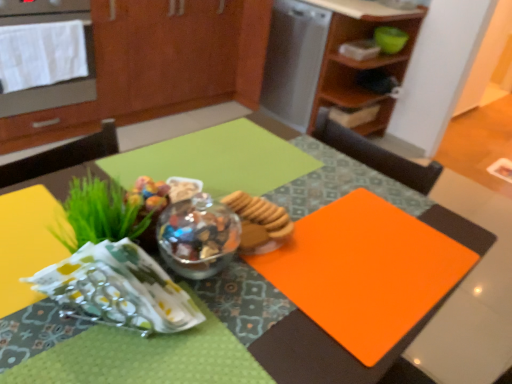
Describe the element at coordinates (361, 61) in the screenshot. The width and height of the screenshot is (512, 384). I see `wooden cabinet at upper right, placed as the 2th cabinetry when sorted from left to right` at that location.

Where is `wooden cabinet at upper right, the first cabinetry in the right-to-left sequence`? The image size is (512, 384). wooden cabinet at upper right, the first cabinetry in the right-to-left sequence is located at coordinates (361, 61).

Image resolution: width=512 pixels, height=384 pixels. In order to click on matte wood cabinetry at upper center, the first cabinetry viewed from the left in this screenshot , I will do `click(158, 67)`.

Describe the element at coordinates (365, 271) in the screenshot. I see `orange matte placemat at center` at that location.

Image resolution: width=512 pixels, height=384 pixels. What do you see at coordinates (294, 60) in the screenshot?
I see `satin silver dishwasher at upper center` at bounding box center [294, 60].

In order to face green leafy grass at left, should I rotate leftwards or rightwards?

Turn left approximately 18.620 degrees to face it.

At what (x,y) coordinates should I click in order to perform the action: click on green leafy grass at left. Please return your answer as a coordinate pair (x, y). Looking at the image, I should click on (99, 213).

In order to click on wooden cabinet at upper right, the first cabinetry in the right-to-left sequence in this screenshot , I will do `click(361, 61)`.

Is satin silver dishwasher at upper center closer to the viewer compared to orange matte placemat at center?

No.

Are satin silver dishwasher at upper center and orange matte placemat at center beside each other?

There is a gap between satin silver dishwasher at upper center and orange matte placemat at center.

Who is smaller, satin silver dishwasher at upper center or orange matte placemat at center?

satin silver dishwasher at upper center is smaller.

Considering the points (198, 100) and (342, 361), which point is in front, point (198, 100) or point (342, 361)?

Point (342, 361)

How different are the orientations of matte wood cabinetry at upper center, the first cabinetry viewed from the left, and orange matte placemat at center in degrees?

The angular difference between matte wood cabinetry at upper center, the first cabinetry viewed from the left, and orange matte placemat at center is 179 degrees.

Does matte wood cabinetry at upper center, the first cabinetry viewed from the left, have a greater width compared to orange matte placemat at center?

Incorrect, the width of matte wood cabinetry at upper center, the first cabinetry viewed from the left, does not surpass that of orange matte placemat at center.

Does point (113, 76) come behind point (379, 34)?

No, it is not.

Considering the sizes of matte wood cabinetry at upper center, the first cabinetry viewed from the left, and teal bowl at upper right in the image, is matte wood cabinetry at upper center, the first cabinetry viewed from the left, taller or shorter than teal bowl at upper right?

In the image, matte wood cabinetry at upper center, the first cabinetry viewed from the left, appears to be taller than teal bowl at upper right.

From the picture: Can you tell me how much matte wood cabinetry at upper center, which is the 2th cabinetry in right-to-left order, and teal bowl at upper right differ in facing direction?

The angular difference between matte wood cabinetry at upper center, which is the 2th cabinetry in right-to-left order, and teal bowl at upper right is 0.526 degrees.

From a real-world perspective, who is located higher, matte wood cabinetry at upper center, which is the 2th cabinetry in right-to-left order, or teal bowl at upper right?

From a 3D spatial view, teal bowl at upper right is above.

Is satin silver dishwasher at upper center far from orange matte placemat at center?

satin silver dishwasher at upper center is positioned a significant distance from orange matte placemat at center.

From the image's perspective, is satin silver dishwasher at upper center located above or below orange matte placemat at center?

Clearly, from the image's perspective, satin silver dishwasher at upper center is above orange matte placemat at center.

How different are the orientations of satin silver dishwasher at upper center and orange matte placemat at center in degrees?

satin silver dishwasher at upper center and orange matte placemat at center are facing 91.2 degrees away from each other.

Between satin silver dishwasher at upper center and orange matte placemat at center, which one appears on the left side from the viewer's perspective?

Positioned to the left is orange matte placemat at center.

Between teal bowl at upper right and wooden cabinet at upper right, the first cabinetry in the right-to-left sequence, which one has more height?

wooden cabinet at upper right, the first cabinetry in the right-to-left sequence.

Considering the sizes of teal bowl at upper right and wooden cabinet at upper right, the first cabinetry in the right-to-left sequence, in the image, is teal bowl at upper right bigger or smaller than wooden cabinet at upper right, the first cabinetry in the right-to-left sequence,?

teal bowl at upper right is smaller than wooden cabinet at upper right, the first cabinetry in the right-to-left sequence.

Considering the positions of objects teal bowl at upper right and wooden cabinet at upper right, placed as the 2th cabinetry when sorted from left to right, in the image provided, who is behind, teal bowl at upper right or wooden cabinet at upper right, placed as the 2th cabinetry when sorted from left to right,?

teal bowl at upper right is behind.

Which of these two, orange matte placemat at center or matte wood cabinetry at upper center, which is the 2th cabinetry in right-to-left order, is bigger?

matte wood cabinetry at upper center, which is the 2th cabinetry in right-to-left order, is bigger.

Based on the photo, how many degrees apart are the facing directions of orange matte placemat at center and matte wood cabinetry at upper center, which is the 2th cabinetry in right-to-left order?

180 degrees.

From a real-world perspective, is orange matte placemat at center positioned above or below matte wood cabinetry at upper center, which is the 2th cabinetry in right-to-left order?

In terms of real-world spatial position, orange matte placemat at center is above matte wood cabinetry at upper center, which is the 2th cabinetry in right-to-left order.

Is orange matte placemat at center not inside satin silver dishwasher at upper center?

Yes, orange matte placemat at center is not within satin silver dishwasher at upper center.

Considering the relative sizes of orange matte placemat at center and satin silver dishwasher at upper center in the image provided, is orange matte placemat at center thinner than satin silver dishwasher at upper center?

Incorrect, the width of orange matte placemat at center is not less than that of satin silver dishwasher at upper center.

In the scene shown: From a real-world perspective, who is located higher, orange matte placemat at center or satin silver dishwasher at upper center?

satin silver dishwasher at upper center is physically above.

The image size is (512, 384). I want to click on appliance behind the orange matte placemat at center, so click(294, 60).

Identify the location of the 2nd cabinetry above the orange matte placemat at center (from the image's perspective). (158, 67).

Looking at this image, estimate the real-world distances between objects in this image. Which object is closer to satin silver dishwasher at upper center, matte wood cabinetry at upper center, the first cabinetry viewed from the left, or orange matte placemat at center?

matte wood cabinetry at upper center, the first cabinetry viewed from the left, is closer to satin silver dishwasher at upper center.

Considering their positions, is wooden cabinet at upper right, placed as the 2th cabinetry when sorted from left to right, positioned closer to green leafy grass at left than matte wood cabinetry at upper center, which is the 2th cabinetry in right-to-left order?

matte wood cabinetry at upper center, which is the 2th cabinetry in right-to-left order, lies closer to green leafy grass at left than the other object.

Which object lies further to the anchor point wooden cabinet at upper right, placed as the 2th cabinetry when sorted from left to right, brushed metal oven at upper left or green leafy grass at left?

Based on the image, green leafy grass at left appears to be further to wooden cabinet at upper right, placed as the 2th cabinetry when sorted from left to right.

When comparing their distances from brushed metal oven at upper left, does green leafy grass at left or matte wood cabinetry at upper center, the first cabinetry viewed from the left, seem closer?

Among the two, matte wood cabinetry at upper center, the first cabinetry viewed from the left, is located nearer to brushed metal oven at upper left.

Considering their positions, is teal bowl at upper right positioned further to brushed metal oven at upper left than orange matte placemat at center?

orange matte placemat at center.

Which object lies nearer to the anchor point brushed metal oven at upper left, matte wood cabinetry at upper center, which is the 2th cabinetry in right-to-left order, or green leafy grass at left?

matte wood cabinetry at upper center, which is the 2th cabinetry in right-to-left order.

Considering their positions, is brushed metal oven at upper left positioned closer to teal bowl at upper right than matte wood cabinetry at upper center, which is the 2th cabinetry in right-to-left order?

matte wood cabinetry at upper center, which is the 2th cabinetry in right-to-left order, is closer to teal bowl at upper right.

Considering their positions, is matte wood cabinetry at upper center, the first cabinetry viewed from the left, positioned closer to teal bowl at upper right than green leafy grass at left?

matte wood cabinetry at upper center, the first cabinetry viewed from the left, is closer to teal bowl at upper right.

Image resolution: width=512 pixels, height=384 pixels. I want to click on place mat between green leafy grass at left and teal bowl at upper right in the front-back direction, so click(365, 271).

I want to click on oven between orange matte placemat at center and satin silver dishwasher at upper center in the front-back direction, so click(45, 55).

This screenshot has height=384, width=512. I want to click on cabinetry situated between satin silver dishwasher at upper center and teal bowl at upper right from left to right, so click(x=361, y=61).

Find the location of `grass located between brushed metal oven at upper left and teal bowl at upper right in the left-right direction`. grass located between brushed metal oven at upper left and teal bowl at upper right in the left-right direction is located at coordinates (99, 213).